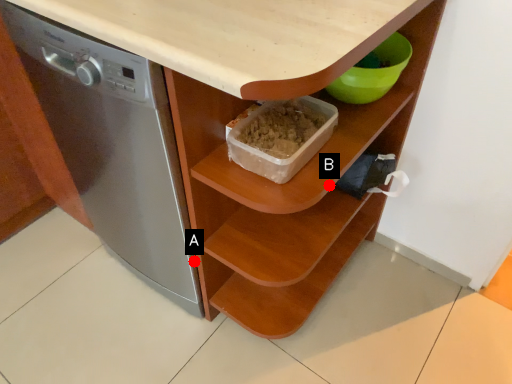
Question: Two points are circled on the image, labeled by A and B beside each circle. Which point appears farthest from the camera in this image?

Choices:
 (A) A is further
 (B) B is further

Answer: (A)